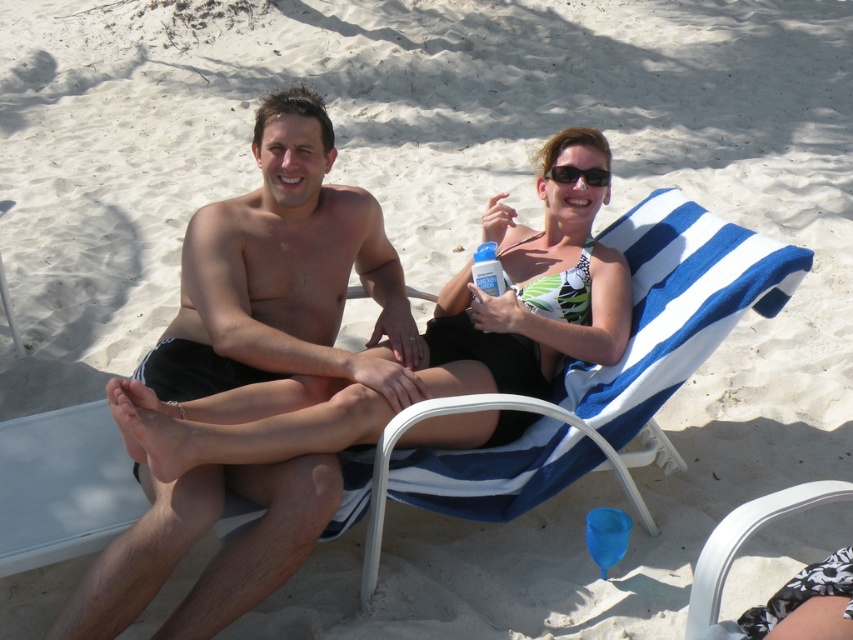
You are a photographer at the beach scene. You need to capture a closeup shot of the black matte shorts at center and the green and white bikini top at center. Which one is located lower in the image?

The black matte shorts at center is positioned under the green and white bikini top at center, so it is located lower in the image.

You are a photographer taking a picture of the beach scene. You notice two points marked in the image at coordinates point (300, 481) and point (409, 429). Which point is closer to your camera lens?

Point (300, 481) is closer to the camera lens than point (409, 429).

You are a photographer trying to capture a photo of the black matte shorts at center and the white plastic beach chair at lower right. Since you want to include both in the frame, which object should you position closer to the camera to ensure both are visible?

The black matte shorts at center is to the left of the white plastic beach chair at lower right. To include both in the frame, position the white plastic beach chair at lower right closer to the camera since it is already to the right of the black matte shorts at center.